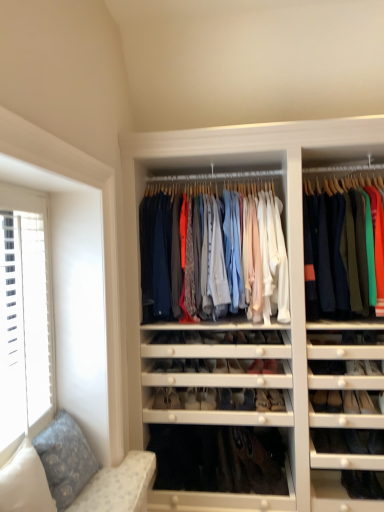
Image resolution: width=384 pixels, height=512 pixels. Identify the location of matte black shoe at center, arranged as the seventh shoe when viewed from the left. (241, 338).

Image resolution: width=384 pixels, height=512 pixels. Describe the element at coordinates (192, 399) in the screenshot. I see `matte white shoe at center, the 5th shoe positioned from the right` at that location.

What is the approximate width of matte white shoe at center, arranged as the fourth shoe when viewed from the left?

11.05 inches.

What do you see at coordinates (208, 399) in the screenshot?
I see `matte white shoe at center, arranged as the fourth shoe when viewed from the left` at bounding box center [208, 399].

Describe the element at coordinates (25, 317) in the screenshot. I see `white textured window at left` at that location.

Measure the distance between point (41,329) and camera.

Point (41,329) is 6.71 feet away from camera.

What do you see at coordinates (65, 458) in the screenshot? Image resolution: width=384 pixels, height=512 pixels. I see `blue textured pillow at lower left, placed as the first pillow when sorted from back to front` at bounding box center [65, 458].

The width and height of the screenshot is (384, 512). What are the coordinates of `matte black shoe at center, arranged as the 3th shoe when viewed from the right` in the screenshot? It's located at (225, 399).

You are a GUI agent. You are given a task and a screenshot of the screen. Output one action in this format:
    pyautogui.click(x=<x>, y=<y>)
    Task: Click on the matte black shoe at center, arranged as the seventh shoe when viewed from the left
    The width and height of the screenshot is (384, 512).
    Given the screenshot: What is the action you would take?
    pyautogui.click(x=241, y=338)

From a real-world perspective, is matte black shoe at center, arranged as the 5th shoe when viewed from the left, physically located above or below matte white shoe at center, which is counted as the 3th shoe, starting from the left?

In terms of real-world spatial position, matte black shoe at center, arranged as the 5th shoe when viewed from the left, is above matte white shoe at center, which is counted as the 3th shoe, starting from the left.

Does point (223, 404) lie in front of point (187, 395)?

Yes, it is in front of point (187, 395).

Does matte black shoe at center, arranged as the 3th shoe when viewed from the right, have a lesser width compared to matte white shoe at center, which is counted as the 3th shoe, starting from the left?

Yes, matte black shoe at center, arranged as the 3th shoe when viewed from the right, is thinner than matte white shoe at center, which is counted as the 3th shoe, starting from the left.

Is matte black shoe at center, arranged as the 5th shoe when viewed from the left, bigger than matte white shoe at center, the 5th shoe positioned from the right?

Correct, matte black shoe at center, arranged as the 5th shoe when viewed from the left, is larger in size than matte white shoe at center, the 5th shoe positioned from the right.

Does point (171, 364) appear closer or farther from the camera than point (369, 303)?

Point (171, 364) is farther from the camera than point (369, 303).

From a real-world perspective, between matte black shoe at center, which is counted as the 7th shoe, starting from the right, and solid navy blue pants at right, positioned as the 2th clothing in left-to-right order, who is vertically lower?

In real-world perspective, matte black shoe at center, which is counted as the 7th shoe, starting from the right, is lower.

In the image, is matte black shoe at center, which is counted as the 7th shoe, starting from the right, on the left side or the right side of solid navy blue pants at right, positioned as the 2th clothing in left-to-right order?

matte black shoe at center, which is counted as the 7th shoe, starting from the right, is to the left of solid navy blue pants at right, positioned as the 2th clothing in left-to-right order.

Is matte black shoe at center, which is counted as the 7th shoe, starting from the right, shorter than solid navy blue pants at right, which is the 1th clothing from right to left?

Yes.

There is a white textured window at left. What are the coordinates of `the 1st shoe below it (from a real-world perspective)` in the screenshot? It's located at (241, 338).

Which is behind, white textured window at left or matte black shoe at center, the 1th shoe viewed from the right?

matte black shoe at center, the 1th shoe viewed from the right, is further from the camera.

Is white textured window at left oriented away from matte black shoe at center, arranged as the seventh shoe when viewed from the left?

white textured window at left is not turned away from matte black shoe at center, arranged as the seventh shoe when viewed from the left.

From a real-world perspective, which is physically below, white textured window at left or matte black shoe at center, the 1th shoe viewed from the right?

From a 3D spatial view, matte black shoe at center, the 1th shoe viewed from the right, is below.

Considering the relative sizes of matte cotton shirts at center, which is counted as the 2th clothing, starting from the right, and matte black shoe at center, arranged as the seventh shoe when viewed from the left, in the image provided, is matte cotton shirts at center, which is counted as the 2th clothing, starting from the right, shorter than matte black shoe at center, arranged as the seventh shoe when viewed from the left,?

Incorrect, the height of matte cotton shirts at center, which is counted as the 2th clothing, starting from the right, does not fall short of that of matte black shoe at center, arranged as the seventh shoe when viewed from the left.

Is matte cotton shirts at center, which is counted as the 2th clothing, starting from the right, further to the viewer compared to matte black shoe at center, the 1th shoe viewed from the right?

No, matte cotton shirts at center, which is counted as the 2th clothing, starting from the right, is closer to the camera.

What's the angular difference between matte cotton shirts at center, positioned as the first clothing in left-to-right order, and matte black shoe at center, arranged as the seventh shoe when viewed from the left,'s facing directions?

1.9 degrees.

Considering the relative sizes of matte cotton shirts at center, which is counted as the 2th clothing, starting from the right, and matte black shoe at center, the 1th shoe viewed from the right, in the image provided, is matte cotton shirts at center, which is counted as the 2th clothing, starting from the right, bigger than matte black shoe at center, the 1th shoe viewed from the right,?

Yes.

Is point (192, 404) positioned in front of point (161, 368)?

No, it is not.

The image size is (384, 512). In order to click on the 1st shoe behind the matte black shoe at center, the 1th shoe when ordered from left to right, starting your count from the anchor in this screenshot , I will do `click(192, 399)`.

Considering the sizes of objects matte white shoe at center, the 5th shoe positioned from the right, and matte black shoe at center, the 1th shoe when ordered from left to right, in the image provided, who is bigger, matte white shoe at center, the 5th shoe positioned from the right, or matte black shoe at center, the 1th shoe when ordered from left to right,?

matte white shoe at center, the 5th shoe positioned from the right.

Can you confirm if fluffy fabric pillow at lower left, the second pillow viewed from the back, is positioned to the left of solid navy blue pants at right, which is the 1th clothing from right to left?

Yes, fluffy fabric pillow at lower left, the second pillow viewed from the back, is to the left of solid navy blue pants at right, which is the 1th clothing from right to left.

Looking at this image, is fluffy fabric pillow at lower left, the second pillow viewed from the back, positioned beyond the bounds of solid navy blue pants at right, which is the 1th clothing from right to left?

fluffy fabric pillow at lower left, the second pillow viewed from the back, is positioned outside solid navy blue pants at right, which is the 1th clothing from right to left.

Are fluffy fabric pillow at lower left, the second pillow viewed from the back, and solid navy blue pants at right, which is the 1th clothing from right to left, located far from each other?

Yes, fluffy fabric pillow at lower left, the second pillow viewed from the back, and solid navy blue pants at right, which is the 1th clothing from right to left, are located far from each other.

Identify the location of the 2nd pillow to the left of the solid navy blue pants at right, which is the 1th clothing from right to left, counting from the anchor's position. This screenshot has width=384, height=512. (25, 482).

Considering the sizes of matte black shoe at center, arranged as the seventh shoe when viewed from the left, and blue textured pillow at lower left, which ranks as the 2th pillow in front-to-back order, in the image, is matte black shoe at center, arranged as the seventh shoe when viewed from the left, taller or shorter than blue textured pillow at lower left, which ranks as the 2th pillow in front-to-back order,?

Considering their sizes, matte black shoe at center, arranged as the seventh shoe when viewed from the left, has less height than blue textured pillow at lower left, which ranks as the 2th pillow in front-to-back order.

How distant is matte black shoe at center, arranged as the seventh shoe when viewed from the left, from blue textured pillow at lower left, placed as the first pillow when sorted from back to front?

A distance of 4.08 feet exists between matte black shoe at center, arranged as the seventh shoe when viewed from the left, and blue textured pillow at lower left, placed as the first pillow when sorted from back to front.

Where is `the 2nd pillow directly beneath the matte black shoe at center, arranged as the seventh shoe when viewed from the left (from a real-world perspective)`? The width and height of the screenshot is (384, 512). the 2nd pillow directly beneath the matte black shoe at center, arranged as the seventh shoe when viewed from the left (from a real-world perspective) is located at coordinates coord(65,458).

Considering the relative sizes of matte black shoe at center, arranged as the seventh shoe when viewed from the left, and blue textured pillow at lower left, which ranks as the 2th pillow in front-to-back order, in the image provided, is matte black shoe at center, arranged as the seventh shoe when viewed from the left, bigger than blue textured pillow at lower left, which ranks as the 2th pillow in front-to-back order,?

Actually, matte black shoe at center, arranged as the seventh shoe when viewed from the left, might be smaller than blue textured pillow at lower left, which ranks as the 2th pillow in front-to-back order.

Find the location of a particular element. Image resolution: width=384 pixels, height=512 pixels. shoe that is the 1st object located below the matte black shoe at center, arranged as the 3th shoe when viewed from the right (from the image's perspective) is located at coordinates (192, 399).

Locate an element on the screen. This screenshot has width=384, height=512. the 4th shoe below the solid navy blue pants at right, positioned as the 2th clothing in left-to-right order (from a real-world perspective) is located at coordinates (162, 366).

Which object lies further to the anchor point white textured window at left, matte white shoe at center, arranged as the fourth shoe when viewed from the left, or solid navy blue pants at right, which is the 1th clothing from right to left?

solid navy blue pants at right, which is the 1th clothing from right to left, is further to white textured window at left.

From the image, which object appears to be farther from matte cotton shirts at center, positioned as the first clothing in left-to-right order, matte black shoe at center, arranged as the 3th shoe when viewed from the right, or matte black shoe at center, arranged as the seventh shoe when viewed from the left?

Based on the image, matte black shoe at center, arranged as the 3th shoe when viewed from the right, appears to be further to matte cotton shirts at center, positioned as the first clothing in left-to-right order.

Which object lies further to the anchor point matte white shoe at center, the 5th shoe positioned from the right, solid navy blue pants at right, which is the 1th clothing from right to left, or fluffy fabric pillow at lower left, the first pillow from the front?

solid navy blue pants at right, which is the 1th clothing from right to left, lies further to matte white shoe at center, the 5th shoe positioned from the right, than the other object.

From the picture: Which object lies further to the anchor point fluffy fabric pillow at lower left, the second pillow viewed from the back, matte cotton shirts at center, which is counted as the 2th clothing, starting from the right, or matte black shoe at center, the 1th shoe viewed from the right?

matte black shoe at center, the 1th shoe viewed from the right.

Which object lies further to the anchor point blue textured pillow at lower left, which ranks as the 2th pillow in front-to-back order, matte white shoe at center, which is counted as the 3th shoe, starting from the left, or fluffy fabric pillow at lower left, the second pillow viewed from the back?

matte white shoe at center, which is counted as the 3th shoe, starting from the left.

Which object lies further to the anchor point matte white shoe at center, which is the fourth shoe in right-to-left order, matte black shoe at center, arranged as the 3th shoe when viewed from the right, or fluffy fabric pillow at lower left, the second pillow viewed from the back?

The object further to matte white shoe at center, which is the fourth shoe in right-to-left order, is fluffy fabric pillow at lower left, the second pillow viewed from the back.

Considering their positions, is matte black shoe at center, the 6th shoe positioned from the right, positioned closer to solid navy blue pants at right, positioned as the 2th clothing in left-to-right order, than fluffy fabric pillow at lower left, the second pillow viewed from the back?

Among the two, matte black shoe at center, the 6th shoe positioned from the right, is located nearer to solid navy blue pants at right, positioned as the 2th clothing in left-to-right order.

From the image, which object appears to be nearer to fluffy fabric pillow at lower left, the second pillow viewed from the back, matte white shoe at center, which is the fourth shoe in right-to-left order, or solid navy blue pants at right, which is the 1th clothing from right to left?

Among the two, matte white shoe at center, which is the fourth shoe in right-to-left order, is located nearer to fluffy fabric pillow at lower left, the second pillow viewed from the back.

Where is `clothing that lies between solid navy blue pants at right, positioned as the 2th clothing in left-to-right order, and matte black shoe at center, arranged as the 3th shoe when viewed from the right, from top to bottom`? The height and width of the screenshot is (512, 384). clothing that lies between solid navy blue pants at right, positioned as the 2th clothing in left-to-right order, and matte black shoe at center, arranged as the 3th shoe when viewed from the right, from top to bottom is located at coordinates (233, 258).

Find the location of `shoe that lies between matte cotton shirts at center, which is counted as the 2th clothing, starting from the right, and matte black shoe at center, positioned as the second shoe in right-to-left order, from top to bottom`. shoe that lies between matte cotton shirts at center, which is counted as the 2th clothing, starting from the right, and matte black shoe at center, positioned as the second shoe in right-to-left order, from top to bottom is located at coordinates (241, 338).

Find the location of a particular element. The height and width of the screenshot is (512, 384). clothing situated between white textured window at left and matte black shoe at center, arranged as the 5th shoe when viewed from the left, from left to right is located at coordinates (233, 258).

Locate an element on the screen. The image size is (384, 512). pillow that lies between matte cotton shirts at center, which is counted as the 2th clothing, starting from the right, and fluffy fabric pillow at lower left, the first pillow from the front, from top to bottom is located at coordinates (65, 458).